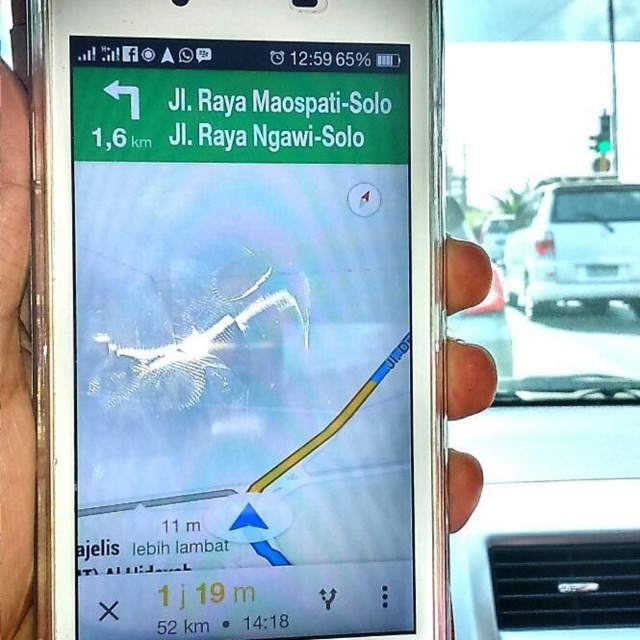
Locate an element on the screen. The width and height of the screenshot is (640, 640). white matte car at right is located at coordinates (573, 244).

Is white matte car at right below metallic at right?

Actually, white matte car at right is above metallic at right.

Does point (529, 266) lie in front of point (474, 369)?

No, it is behind (474, 369).

At what (x,y) coordinates should I click in order to perform the action: click on white matte car at right. Please return your answer as a coordinate pair (x, y). The width and height of the screenshot is (640, 640). Looking at the image, I should click on (573, 244).

Is green matte navigation screen at upper center to the left of brown leather hand at upper left from the viewer's perspective?

In fact, green matte navigation screen at upper center is to the right of brown leather hand at upper left.

Which is above, green matte navigation screen at upper center or brown leather hand at upper left?

Positioned higher is green matte navigation screen at upper center.

Between point (134, 227) and point (12, 352), which one is positioned in front?

Point (12, 352) is in front.

What are the coordinates of `green matte navigation screen at upper center` in the screenshot? It's located at (241, 339).

Is brown leather hand at upper left below white matte van at center?

Yes.

Which is more to the right, brown leather hand at upper left or white matte van at center?

white matte van at center is more to the right.

Is point (12, 428) closer to camera compared to point (488, 256)?

Yes, point (12, 428) is in front of point (488, 256).

The image size is (640, 640). I want to click on brown leather hand at upper left, so click(x=13, y=369).